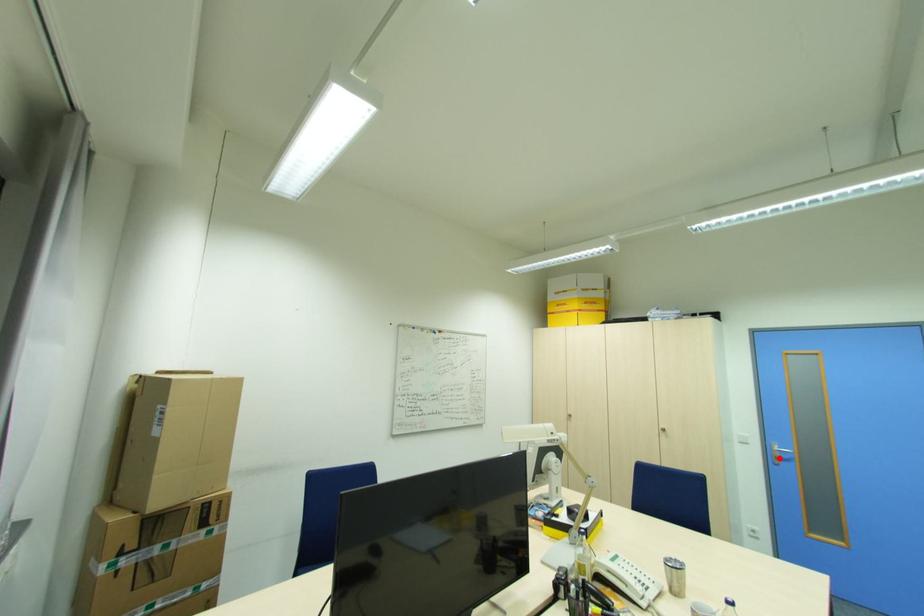
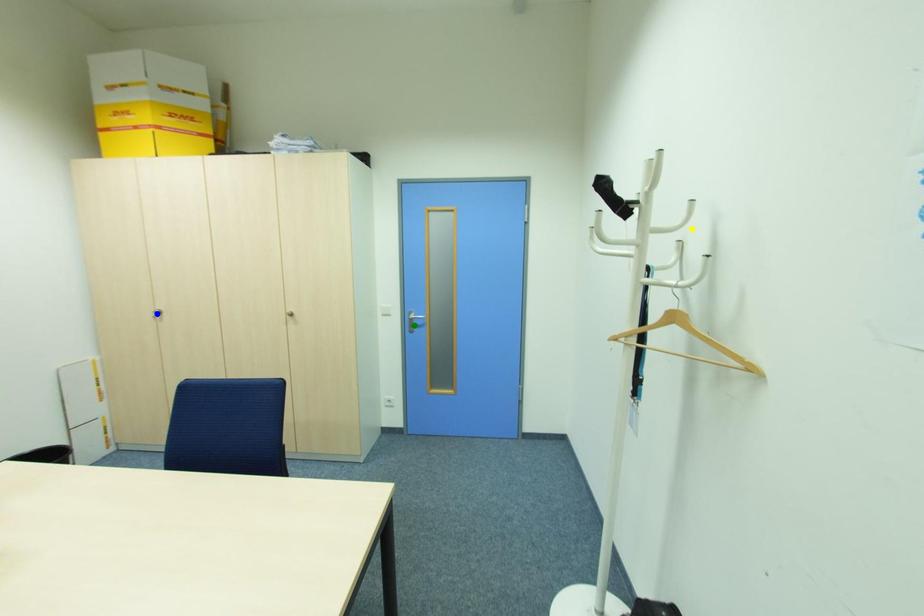
Question: I am providing you with two images of the same scene from different viewpoints. A red point is marked on the first image. You are given multiple points on the second image. Which point in image 2 represents the same 3d spot as the red point in image 1?

Choices:
 (A) green point
 (B) yellow point
 (C) blue point

Answer: (A)